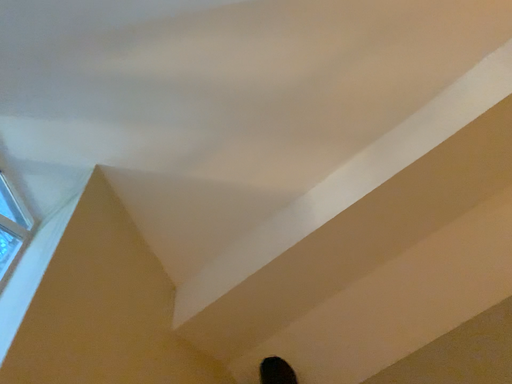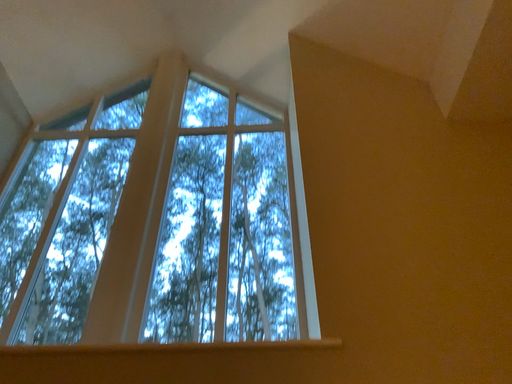
Question: Which way did the camera rotate in the video?

Choices:
 (A) rotated right
 (B) rotated left

Answer: (B)